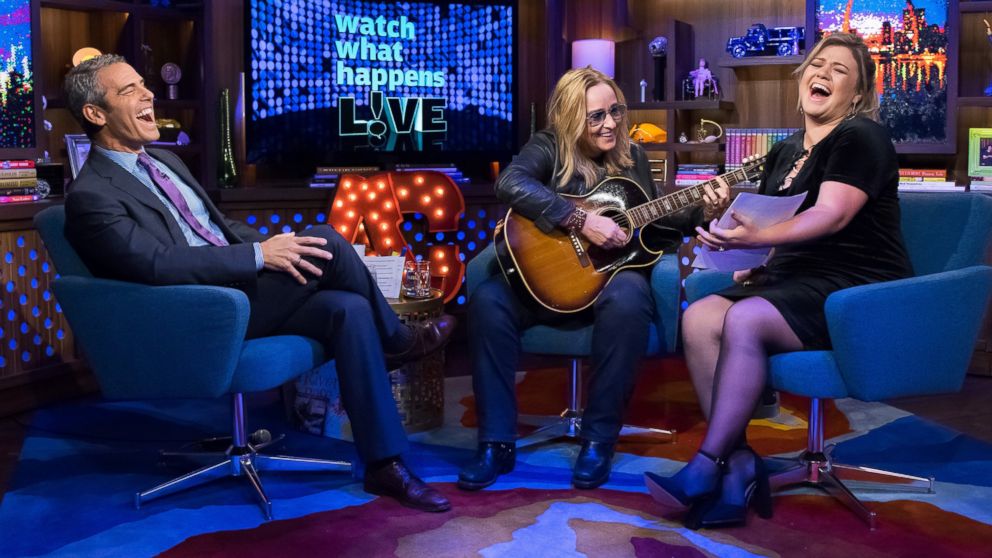
Locate an element on the screen. chair is located at coordinates (913, 297), (668, 272), (173, 338).